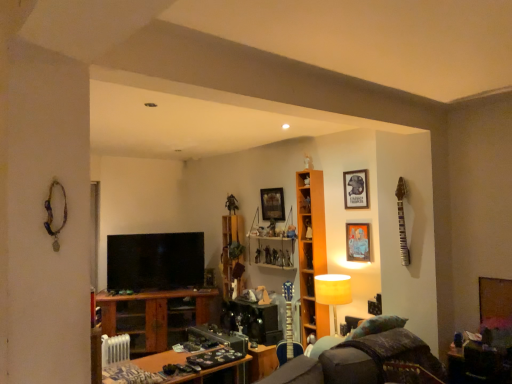
Question: Visually, is matte black picture frame at upper right, the second picture frame viewed from the back, positioned to the left or to the right of matte yellow lampshade at center?

Choices:
 (A) right
 (B) left

Answer: (A)

Question: Considering the positions of point (365, 195) and point (349, 279), is point (365, 195) closer or farther from the camera than point (349, 279)?

Choices:
 (A) farther
 (B) closer

Answer: (A)

Question: Which object is positioned closest to the metallic silver picture frame at upper right, the first picture frame positioned from the front?

Choices:
 (A) wooden table at lower right, which is the 1th table in right-to-left order
 (B) wooden table at lower left, which appears as the 2th table when viewed from the right
 (C) matte yellow lampshade at center
 (D) wooden shelves at center, the second cabinet in the back-to-front sequence
 (E) orange wood shelf at center

Answer: (C)

Question: Considering the real-world distances, which object is farthest from the velvet dark brown swivel chair at lower right?

Choices:
 (A) metallic silver picture frame at upper right, which is the 2th picture frame from right to left
 (B) wooden picture frame at upper center, positioned as the 3th picture frame in right-to-left order
 (C) wooden table at lower right, which is the 1th table in right-to-left order
 (D) wooden cabinet at center, which appears as the first cabinet when viewed from the front
 (E) matte black tv at center

Answer: (E)